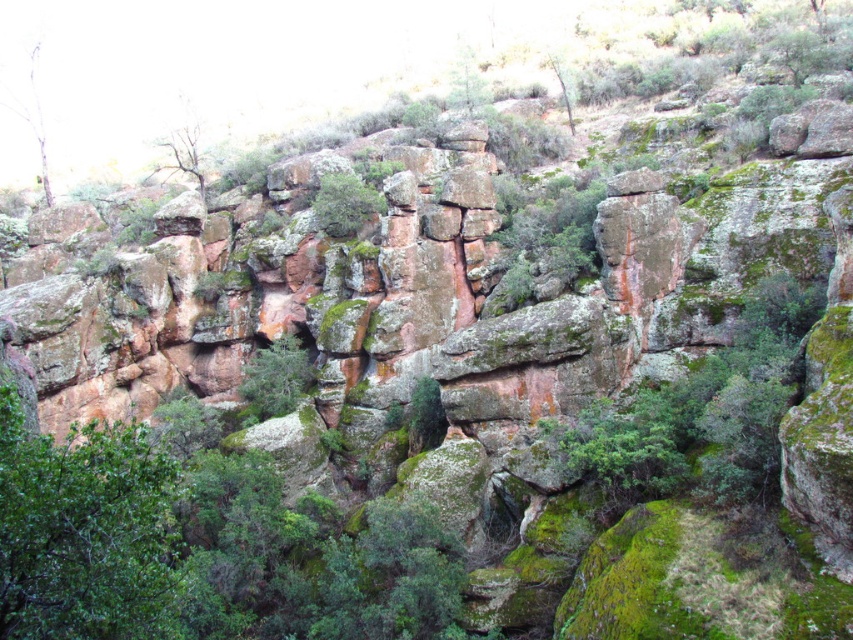
Question: Considering the real-world distances, which object is closest to the green leafy tree at lower left?

Choices:
 (A) green mossy rock at center
 (B) green mossy rock at upper center
 (C) green mossy tree at upper center
 (D) green mossy tree at upper left

Answer: (A)

Question: From the image, what is the correct spatial relationship of green leafy tree at lower left in relation to green mossy rock at center?

Choices:
 (A) right
 (B) left

Answer: (B)

Question: Does green leafy tree at lower left have a smaller size compared to green mossy rock at upper center?

Choices:
 (A) yes
 (B) no

Answer: (B)

Question: Among these objects, which one is farthest from the camera?

Choices:
 (A) green leafy tree at lower left
 (B) green mossy tree at upper left
 (C) green mossy tree at upper center

Answer: (B)

Question: Does green leafy tree at lower left appear under green mossy tree at upper left?

Choices:
 (A) no
 (B) yes

Answer: (B)

Question: Estimate the real-world distances between objects in this image. Which object is closer to the green leafy tree at lower left?

Choices:
 (A) green mossy tree at upper left
 (B) green mossy tree at upper center
 (C) green mossy rock at upper center

Answer: (A)